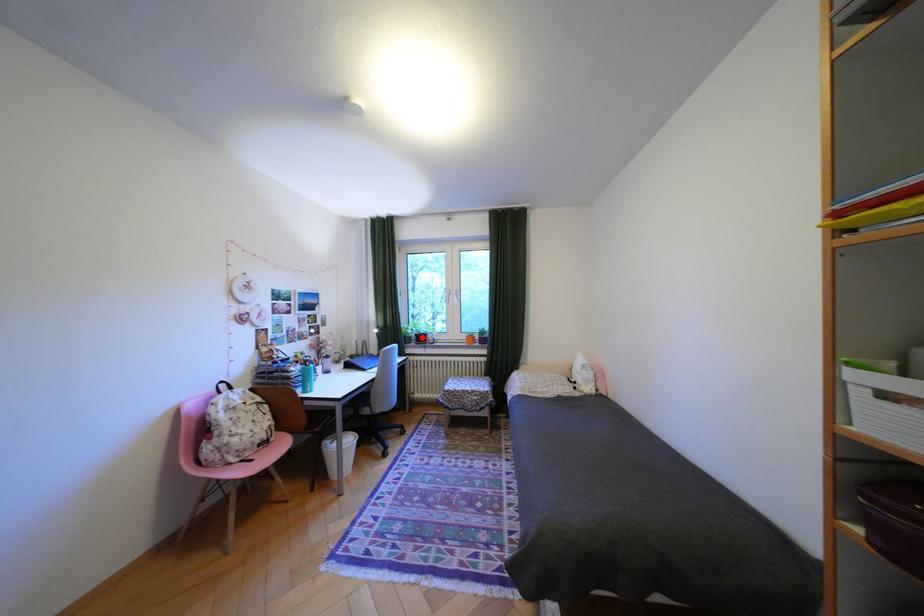
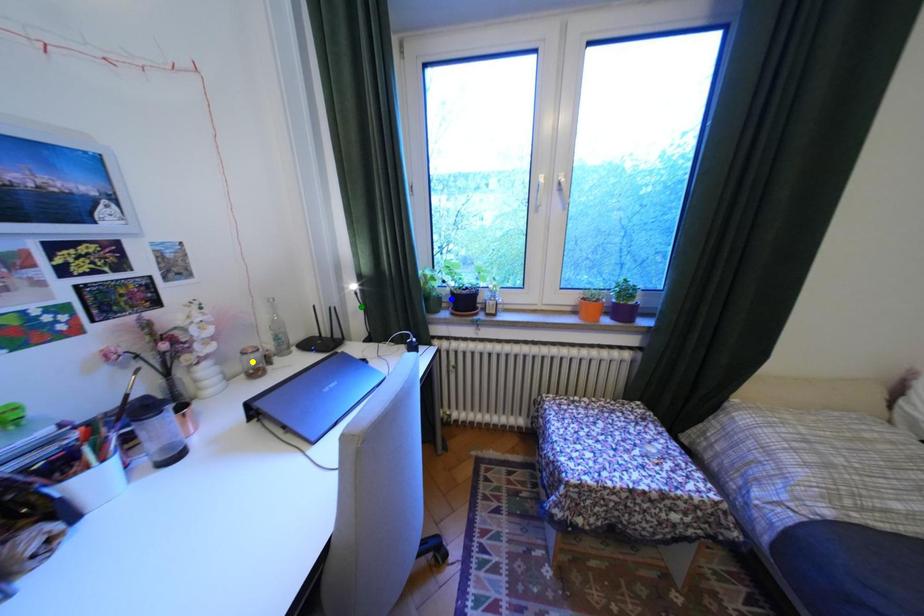
Question: I am providing you with two images of the same scene from different viewpoints. A red point is marked on the first image. You are given multiple points on the second image. Which point in image 2 represents the same 3d spot as the red point in image 1?

Choices:
 (A) green point
 (B) blue point
 (C) yellow point

Answer: (B)